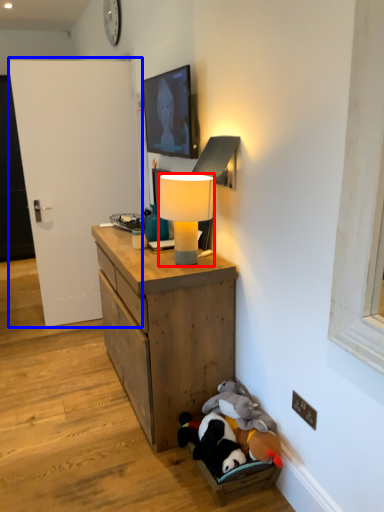
Question: Which object appears farthest to the camera in this image, lamp (highlighted by a red box) or door (highlighted by a blue box)?

Choices:
 (A) lamp
 (B) door

Answer: (B)